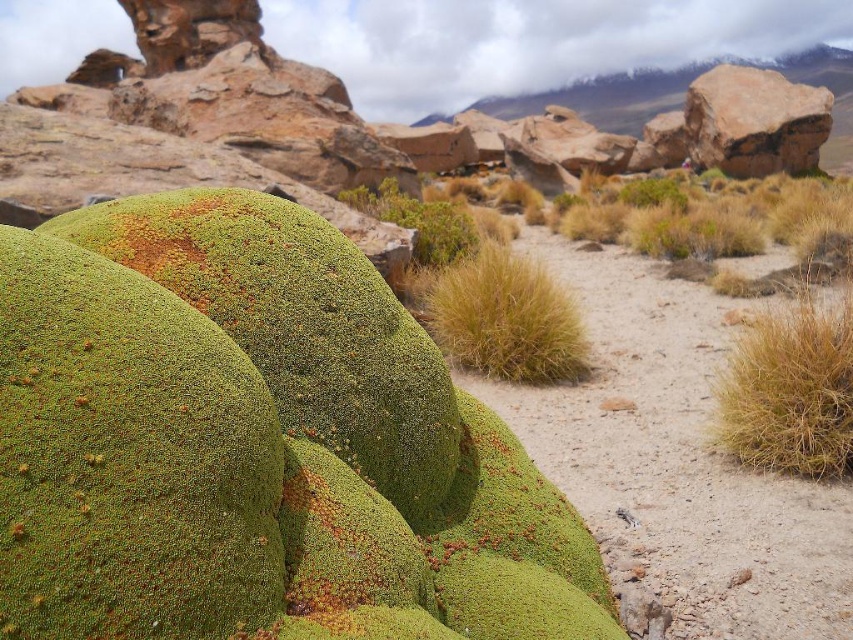
Question: Does dry straw-like grass at right appear over dry grass at center?

Choices:
 (A) no
 (B) yes

Answer: (A)

Question: Is dry straw-like grass at right closer to camera compared to dry grass at center?

Choices:
 (A) yes
 (B) no

Answer: (A)

Question: Which of the following is the farthest from the observer?

Choices:
 (A) (746, 381)
 (B) (579, 333)

Answer: (B)

Question: Can you confirm if dry straw-like grass at right is positioned to the left of dry grass at center?

Choices:
 (A) yes
 (B) no

Answer: (B)